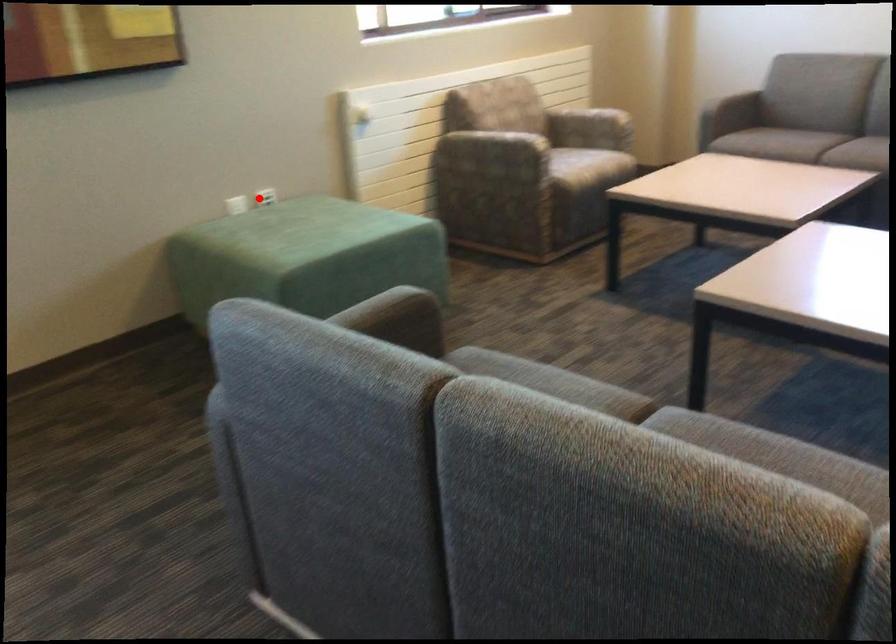
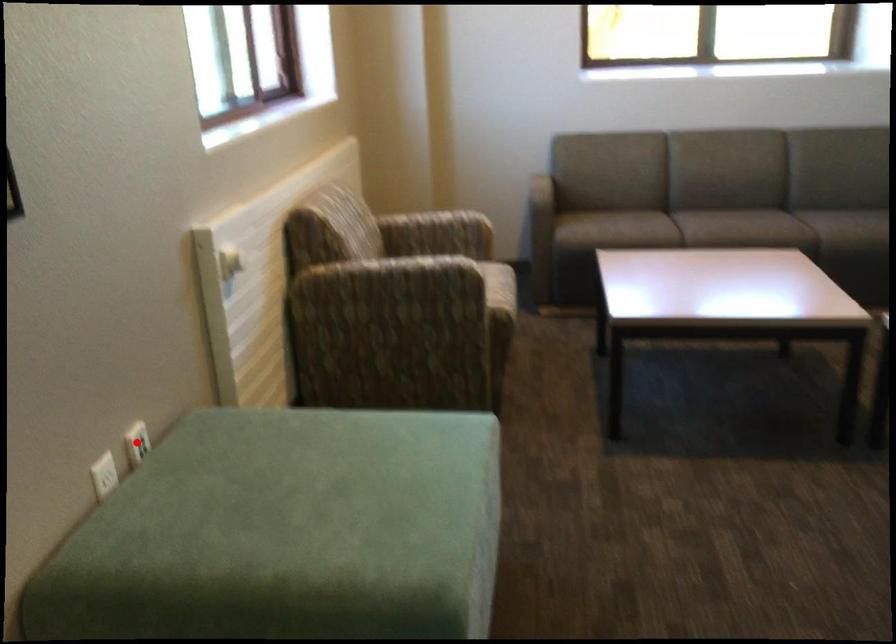
I am providing you with two images of the same scene from different viewpoints. A red point is marked on the first image and another point is marked on the second image. Is the marked point in image1 the same physical position as the marked point in image2?

Yes